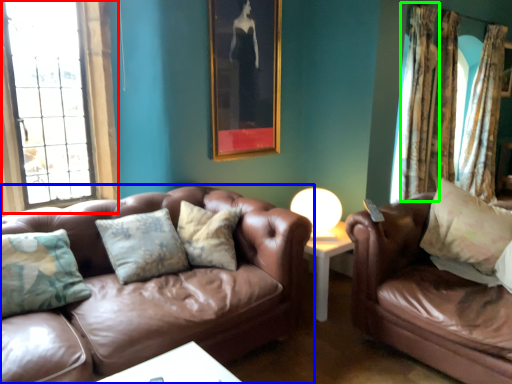
Question: Which object is the farthest from window (highlighted by a red box)? Choose among these: studio couch (highlighted by a blue box) or curtain (highlighted by a green box).

Choices:
 (A) studio couch
 (B) curtain

Answer: (B)